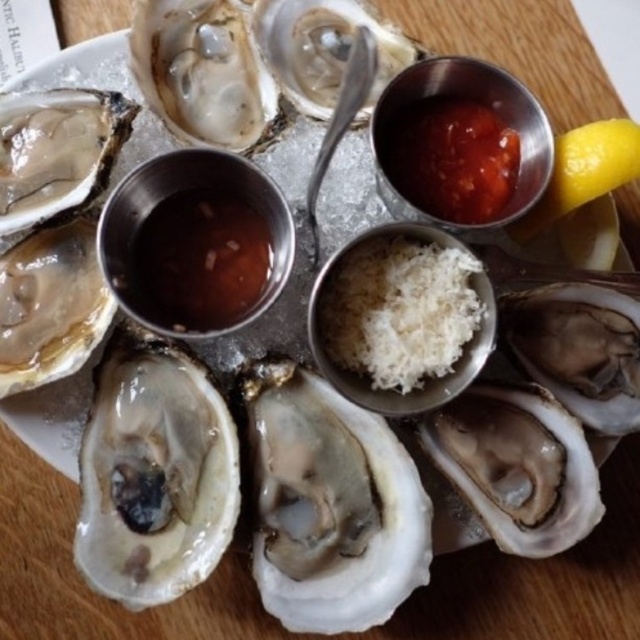
Question: Can you confirm if tomato paste at upper center is smaller than yellow matte lemon at upper right?

Choices:
 (A) yes
 (B) no

Answer: (A)

Question: Does white shredded cheese at center have a greater width compared to yellow matte lemon at upper right?

Choices:
 (A) no
 (B) yes

Answer: (B)

Question: Which of the following is the closest to the observer?

Choices:
 (A) (156, 227)
 (B) (593, 141)
 (C) (468, 256)
 (D) (420, 108)

Answer: (C)

Question: Does semi-translucent brown sauce at center have a greater width compared to tomato paste at upper center?

Choices:
 (A) yes
 (B) no

Answer: (B)

Question: Which is nearer to the tomato paste at upper center?

Choices:
 (A) semi-translucent brown sauce at center
 (B) yellow matte lemon at upper right

Answer: (B)

Question: Which object appears farthest from the camera in this image?

Choices:
 (A) tomato paste at upper center
 (B) yellow matte lemon at upper right

Answer: (A)